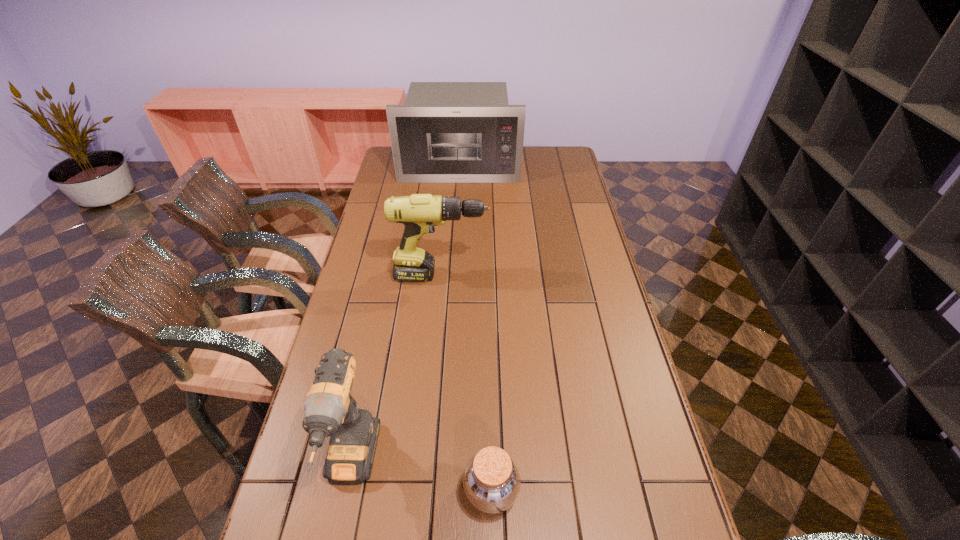
Locate an element on the screen. This screenshot has width=960, height=540. free area in between the microwave oven and the shortest object is located at coordinates (475, 329).

I want to click on free space between the microwave oven and the nearer drill, so click(x=405, y=316).

Locate an element on the screen. Image resolution: width=960 pixels, height=540 pixels. unoccupied position between the third nearest object and the shortest object is located at coordinates (467, 383).

Locate which object is the third closest to the nearer drill. Please provide its 2D coordinates. Your answer should be formatted as a tuple, i.e. [(x, y)], where the tuple contains the x and y coordinates of a point satisfying the conditions above.

[(446, 132)]

Select which object appears as the third closest to the nearer drill. Please provide its 2D coordinates. Your answer should be formatted as a tuple, i.e. [(x, y)], where the tuple contains the x and y coordinates of a point satisfying the conditions above.

[(446, 132)]

The width and height of the screenshot is (960, 540). In order to click on vacant region that satisfies the following two spatial constraints: 1. on the handle side of the farther drill; 2. with the drill bit of the nearer drill facing forward in this screenshot , I will do `click(424, 466)`.

The width and height of the screenshot is (960, 540). I want to click on vacant region that satisfies the following two spatial constraints: 1. on the handle side of the farther drill; 2. on the back side of the jar, so click(x=422, y=491).

You are a GUI agent. You are given a task and a screenshot of the screen. Output one action in this format:
    pyautogui.click(x=<x>, y=<y>)
    Task: Click on the free space that satisfies the following two spatial constraints: 1. on the front-facing side of the microwave oven; 2. on the handle side of the farther drill
    The height and width of the screenshot is (540, 960).
    Given the screenshot: What is the action you would take?
    (x=453, y=275)

Locate an element on the screen. The width and height of the screenshot is (960, 540). vacant region that satisfies the following two spatial constraints: 1. on the front-facing side of the farthest object; 2. on the left side of the shortest object is located at coordinates (439, 491).

You are a GUI agent. You are given a task and a screenshot of the screen. Output one action in this format:
    pyautogui.click(x=<x>, y=<y>)
    Task: Click on the vacant point that satisfies the following two spatial constraints: 1. on the front-facing side of the microwave oven; 2. on the handle side of the third nearest object
    The height and width of the screenshot is (540, 960).
    Given the screenshot: What is the action you would take?
    pyautogui.click(x=453, y=275)